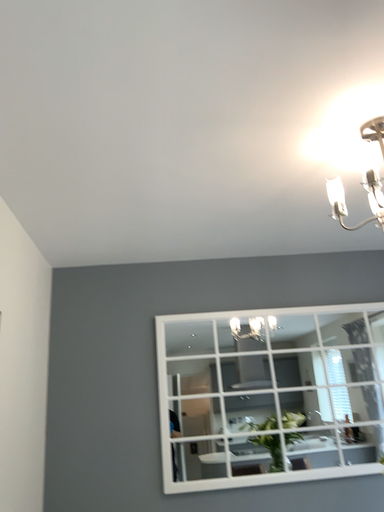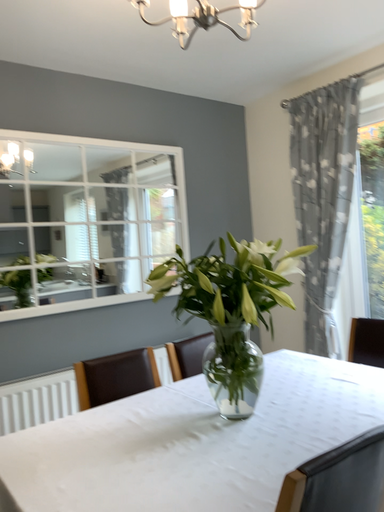
Question: How did the camera likely rotate when shooting the video?

Choices:
 (A) rotated right
 (B) rotated left

Answer: (A)